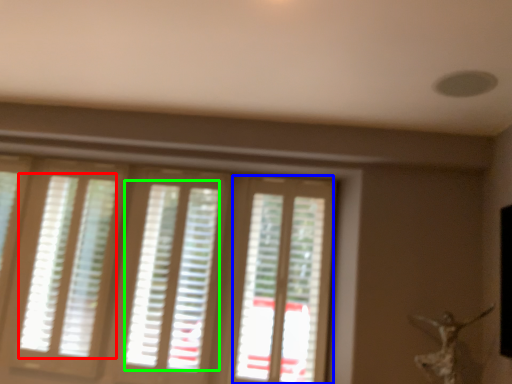
Question: Based on their relative distances, which object is nearer to blind (highlighted by a red box)? Choose from screen door (highlighted by a blue box) and blind (highlighted by a green box).

Choices:
 (A) screen door
 (B) blind

Answer: (B)